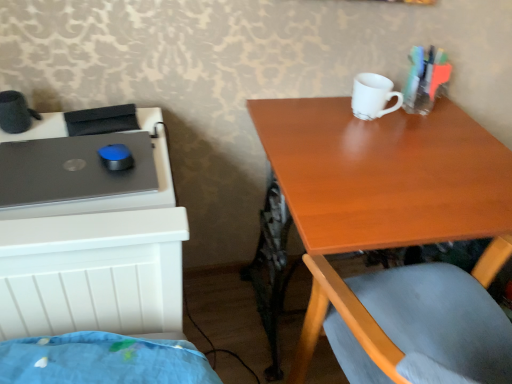
This screenshot has height=384, width=512. In order to click on vacant region to the right of translucent plastic markers at upper right in this screenshot , I will do `click(456, 122)`.